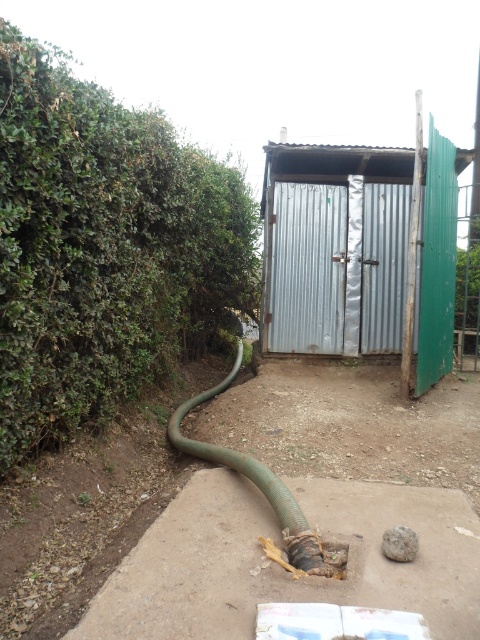
Is green leafy hedge at left to the left of green rubber hose at center from the viewer's perspective?

Correct, you'll find green leafy hedge at left to the left of green rubber hose at center.

Between green leafy hedge at left and green rubber hose at center, which one is positioned lower?

green rubber hose at center is below.

Identify the location of green leafy hedge at left. (103, 248).

Where is `green leafy hedge at left`? green leafy hedge at left is located at coordinates (103, 248).

Is green rubber hose at center smaller than gray rough stone at lower center?

Actually, green rubber hose at center might be larger than gray rough stone at lower center.

Does green rubber hose at center have a lesser height compared to gray rough stone at lower center?

No, green rubber hose at center is not shorter than gray rough stone at lower center.

Is point (282, 518) closer to viewer compared to point (412, 552)?

No, (282, 518) is behind (412, 552).

Find the location of a particular element. This screenshot has width=480, height=640. green rubber hose at center is located at coordinates (264, 490).

Which is in front, point (24, 99) or point (388, 531)?

Point (388, 531) is in front.

Does point (118, 394) come farther from viewer compared to point (403, 548)?

Yes.

Describe the element at coordinates (103, 248) in the screenshot. Image resolution: width=480 pixels, height=640 pixels. I see `green leafy hedge at left` at that location.

Locate an element on the screen. This screenshot has width=480, height=640. green leafy hedge at left is located at coordinates (103, 248).